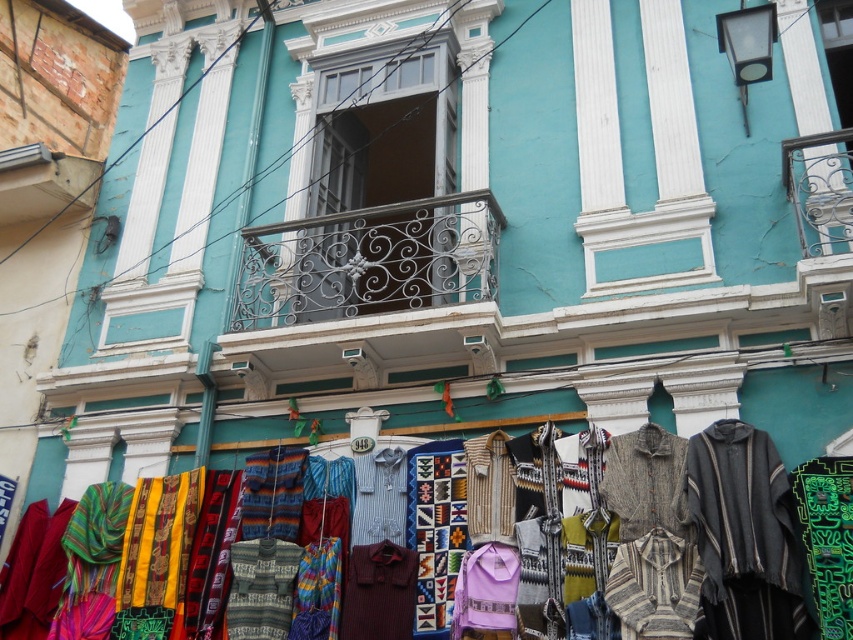
You are a customer standing at the entrance of the building and want to pick up both the knitted multicolored shawl at center and the maroon knitted sweater at center. Which item should you approach first to minimize the walking distance?

The knitted multicolored shawl at center and maroon knitted sweater at center are both located at the center, so you can pick either one first as they are at the same central position.

Consider the image. You are standing on the street in front of the turquoise building and want to walk towards the two points marked in the image. Which point, point (383, 577) or point (399, 483), will you reach first?

You will reach point (383, 577) first because it is closer to you than point (399, 483).

You are a customer looking to buy a new outfit. You see the maroon knitted sweater at center and the blue striped shirt at center displayed on the ground level. Which item takes up less space in your shopping bag?

The maroon knitted sweater at center is smaller than the blue striped shirt at center, so it will take up less space in your shopping bag.